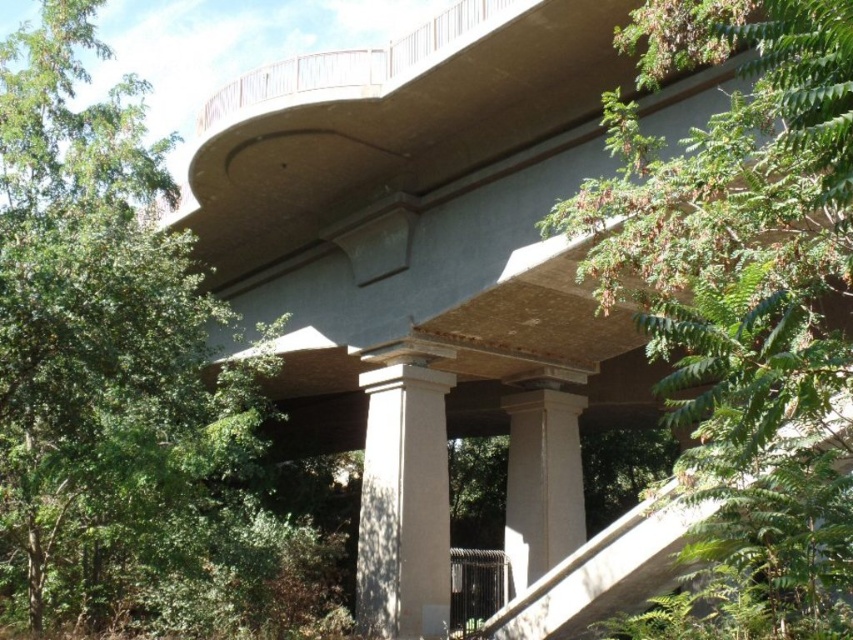
Between point (273, 118) and point (550, 552), which one is positioned in front?

Point (273, 118) is more forward.

Where is `concrete at center`? concrete at center is located at coordinates coord(421,216).

Which is more to the right, green leafy tree at upper left or concrete stairs at center?

From the viewer's perspective, concrete stairs at center appears more on the right side.

Between point (83, 176) and point (657, 492), which one is positioned behind?

Positioned behind is point (83, 176).

Find the location of a particular element. This screenshot has width=853, height=640. green leafy tree at upper left is located at coordinates (99, 344).

Does point (206, 438) lie in front of point (415, 586)?

Yes, point (206, 438) is closer to viewer.

I want to click on green leafy tree at upper left, so click(99, 344).

The height and width of the screenshot is (640, 853). What do you see at coordinates (99, 344) in the screenshot? I see `green leafy tree at upper left` at bounding box center [99, 344].

Locate an element on the screen. green leafy tree at upper left is located at coordinates (99, 344).